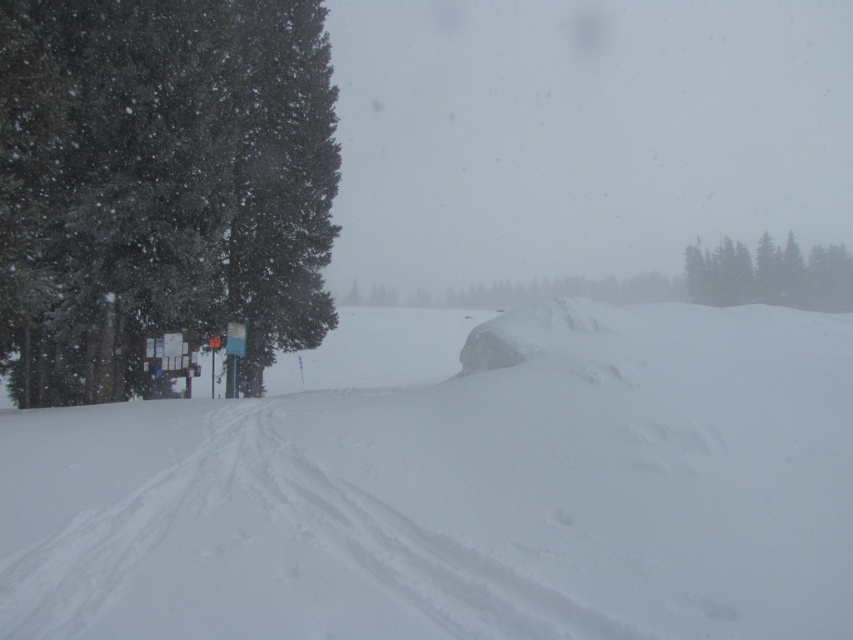
Is point (252, 52) positioned before point (822, 291)?

Yes, point (252, 52) is closer to viewer.

Which is more to the right, snow-covered evergreen at left or green textured trees at upper right?

green textured trees at upper right

I want to click on snow-covered evergreen at left, so click(x=160, y=186).

Find the location of `snow-covered evergreen at left`. snow-covered evergreen at left is located at coordinates tap(160, 186).

Which is below, white powdery snow at center or snow-covered evergreen at left?

Positioned lower is white powdery snow at center.

Between point (225, 536) and point (0, 205), which one is positioned behind?

The point (0, 205) is behind.

Identify the location of white powdery snow at center. The height and width of the screenshot is (640, 853). (457, 486).

Is white powdery snow at center wider than green textured trees at upper right?

In fact, white powdery snow at center might be narrower than green textured trees at upper right.

Can you confirm if white powdery snow at center is taller than green textured trees at upper right?

No, white powdery snow at center is not taller than green textured trees at upper right.

Measure the distance between point (254,515) and camera.

A distance of 7.51 meters exists between point (254,515) and camera.

The width and height of the screenshot is (853, 640). I want to click on white powdery snow at center, so click(x=457, y=486).